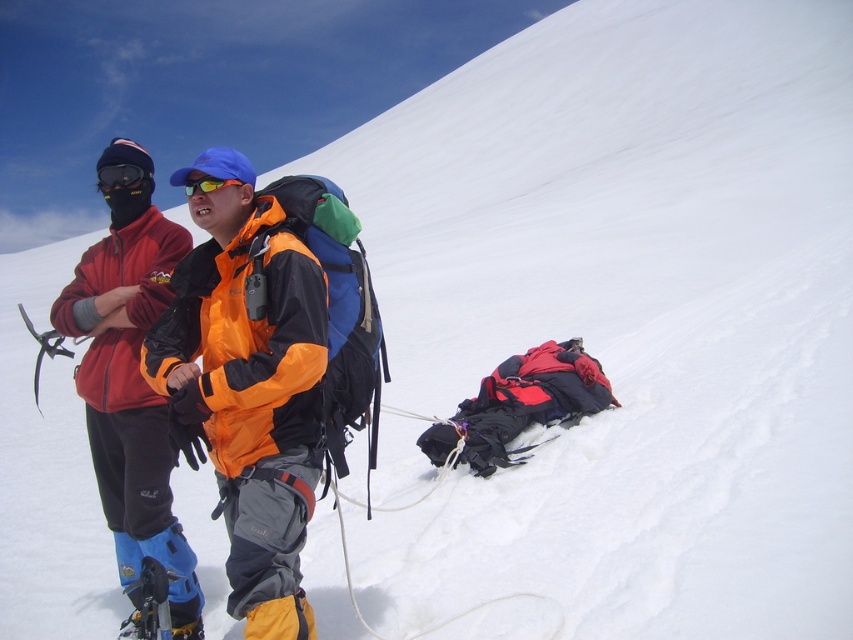
You are planning to take a photo of the matte orange jacket at center from the top of the snowy slope. Given the jacket is at coordinates point 0.609, 0.161, which direction should you move to get a clear view of it?

The matte orange jacket at center is located at point (x=136, y=388), so you should move to a position above this coordinate to get a clear view from the top of the snowy slope.

You are planning to take a photo of the matte orange jacket at center and the black matte goggles at upper left. Since you want both items to be clearly visible in the frame, which object should you focus on first to ensure proper focus?

The matte orange jacket at center is taller than the black matte goggles at upper left, so you should focus on the matte orange jacket at center first to ensure proper focus on the larger object.